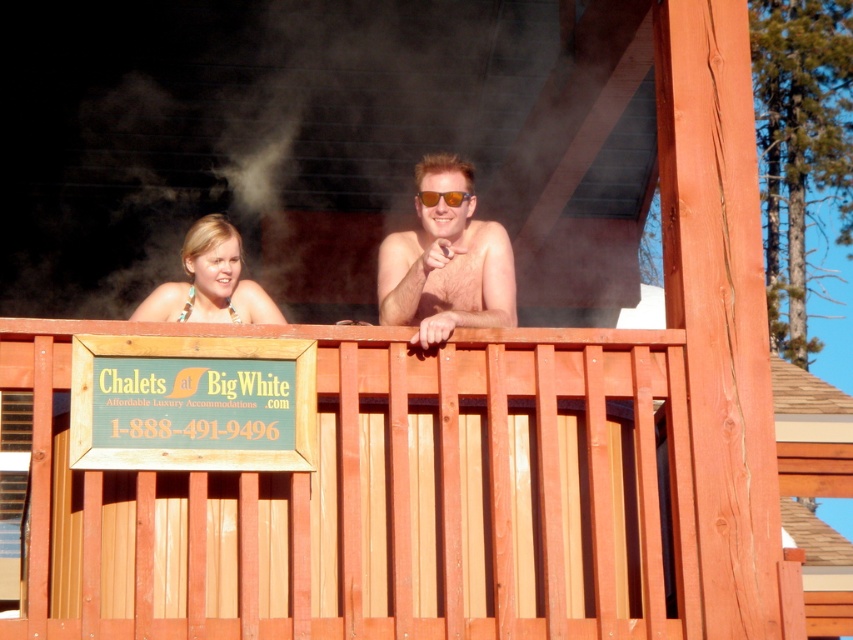
Question: Can you confirm if matte skin couple at center is positioned below matte gold sunglasses at upper center?

Choices:
 (A) no
 (B) yes

Answer: (B)

Question: Is wooden slats at center thinner than matte gold necklace at upper left?

Choices:
 (A) yes
 (B) no

Answer: (B)

Question: Which object appears closest to the camera in this image?

Choices:
 (A) matte gold necklace at upper left
 (B) matte skin couple at center

Answer: (A)

Question: Which of the following is the farthest from the observer?

Choices:
 (A) (206, 292)
 (B) (466, 224)
 (C) (215, 244)
 (D) (538, 468)

Answer: (B)

Question: Which of the following is the farthest from the observer?

Choices:
 (A) matte skin couple at center
 (B) wooden slats at center
 (C) matte gold necklace at upper left

Answer: (A)

Question: Does matte skin couple at center lie in front of matte gold necklace at upper left?

Choices:
 (A) no
 (B) yes

Answer: (A)